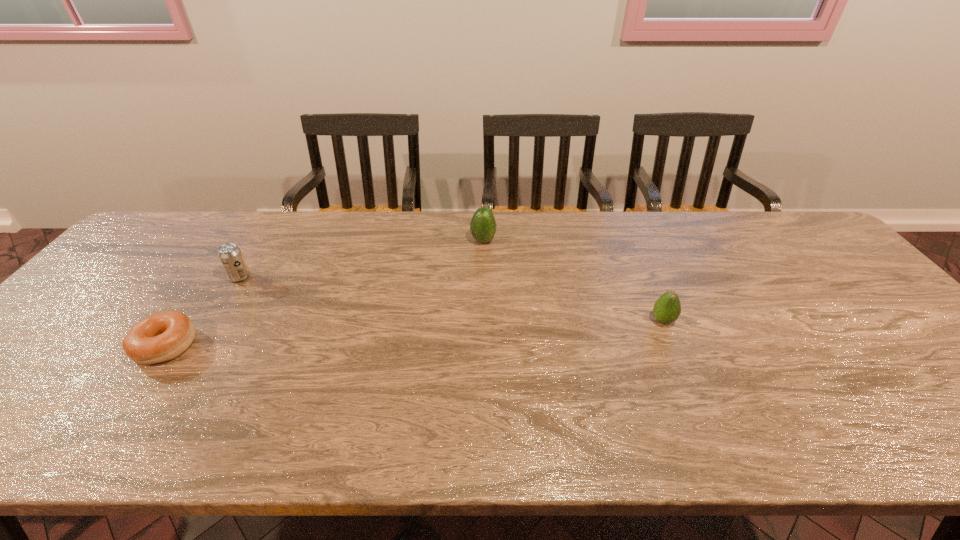
I want to click on object that is positioned at the far edge, so click(x=483, y=226).

I want to click on free space at the far edge of the desktop, so click(218, 234).

The image size is (960, 540). In the image, there is a desktop. Find the location of `blank space at the near edge`. blank space at the near edge is located at coordinates (760, 434).

Find the location of a particular element. free region at the far right corner of the desktop is located at coordinates (766, 234).

Where is `vacant space in between the rightmost object and the bagel`? This screenshot has height=540, width=960. vacant space in between the rightmost object and the bagel is located at coordinates (414, 333).

Find the location of `free area in between the second object from right to left and the right avocado`. free area in between the second object from right to left and the right avocado is located at coordinates (573, 281).

Find the location of `free space that is in between the rightmost object and the bagel`. free space that is in between the rightmost object and the bagel is located at coordinates (414, 333).

Where is `vacant region between the shorter avocado and the shortest object`? This screenshot has width=960, height=540. vacant region between the shorter avocado and the shortest object is located at coordinates (414, 333).

You are a GUI agent. You are given a task and a screenshot of the screen. Output one action in this format:
    pyautogui.click(x=<x>, y=<y>)
    Task: Click on the free area in between the third nearest object and the bagel
    
    Given the screenshot: What is the action you would take?
    pyautogui.click(x=203, y=312)

You are a GUI agent. You are given a task and a screenshot of the screen. Output one action in this format:
    pyautogui.click(x=<x>, y=<y>)
    Task: Click on the free space between the taller avocado and the beer can
    
    Given the screenshot: What is the action you would take?
    pyautogui.click(x=362, y=259)